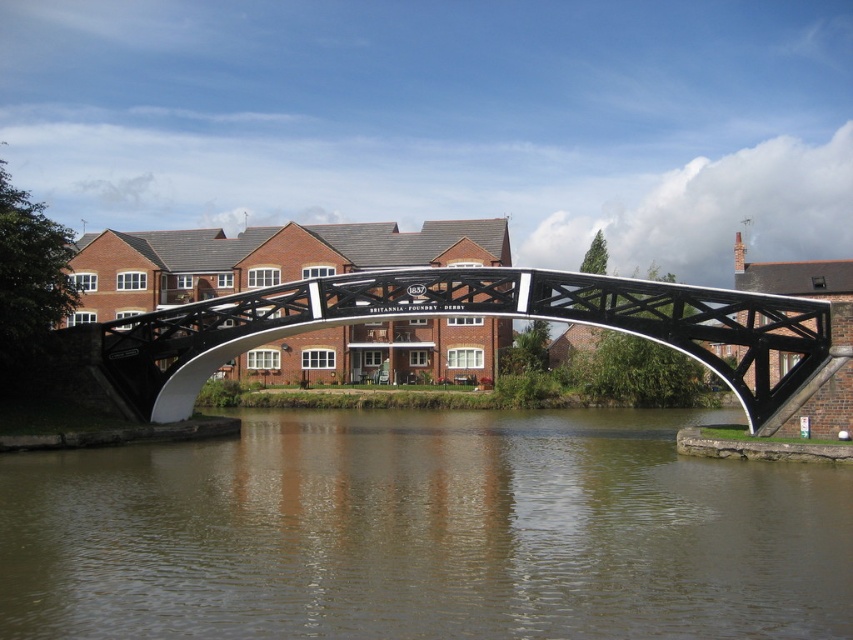
Question: Can you confirm if brown murky water at center is thinner than black metal pedestrian bridge at center?

Choices:
 (A) yes
 (B) no

Answer: (A)

Question: Where is brown murky water at center located in relation to black metal pedestrian bridge at center in the image?

Choices:
 (A) right
 (B) left

Answer: (B)

Question: Among these objects, which one is nearest to the camera?

Choices:
 (A) brown murky water at center
 (B) black metal pedestrian bridge at center

Answer: (A)

Question: Is brown murky water at center positioned behind black metal pedestrian bridge at center?

Choices:
 (A) yes
 (B) no

Answer: (B)